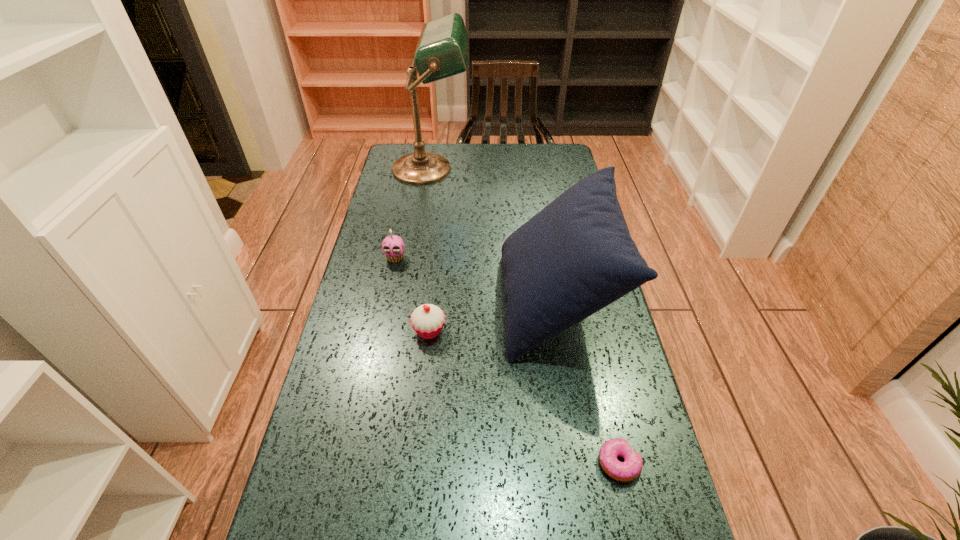
Where is `table lamp`? This screenshot has height=540, width=960. table lamp is located at coordinates (442, 49).

The image size is (960, 540). In order to click on the tallest object in this screenshot , I will do `click(442, 49)`.

This screenshot has height=540, width=960. What are the coordinates of `cushion` in the screenshot? It's located at (573, 258).

Where is `the taller cupcake`? This screenshot has height=540, width=960. the taller cupcake is located at coordinates (393, 246).

This screenshot has width=960, height=540. In order to click on the farther cupcake in this screenshot , I will do `click(393, 246)`.

Locate an element on the screen. The image size is (960, 540). the right cupcake is located at coordinates (427, 320).

The image size is (960, 540). What are the coordinates of `the second shortest object` in the screenshot? It's located at (427, 320).

Locate an element on the screen. This screenshot has width=960, height=540. doughnut is located at coordinates coord(631,468).

This screenshot has width=960, height=540. I want to click on the shortest object, so click(x=631, y=468).

In order to click on vacant space located above the green lampshade of the table lamp in this screenshot , I will do `click(523, 169)`.